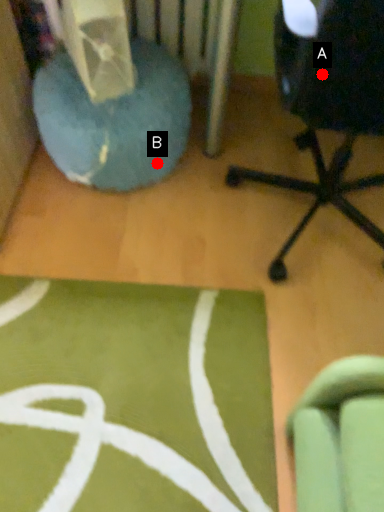
Question: Two points are circled on the image, labeled by A and B beside each circle. Which point is closer to the camera taking this photo?

Choices:
 (A) A is closer
 (B) B is closer

Answer: (A)